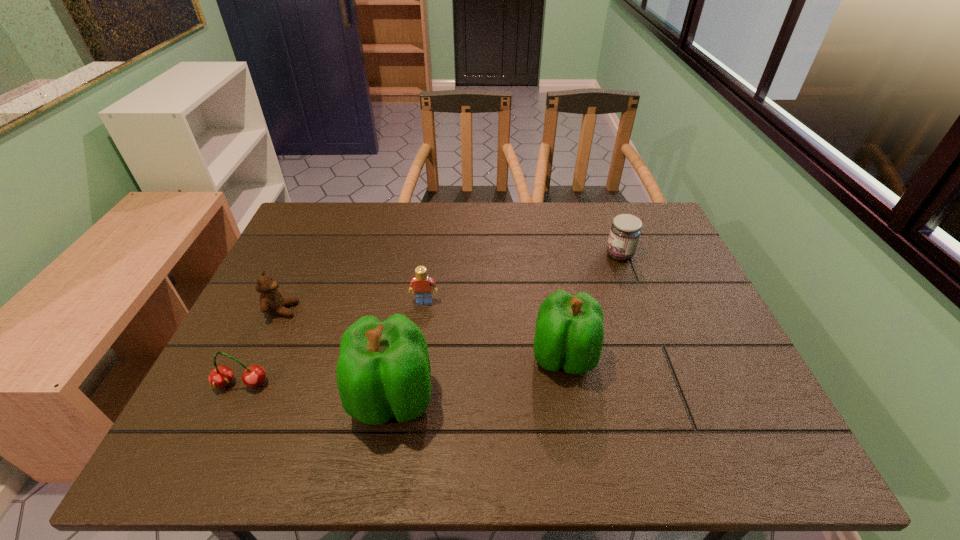
I want to click on the taller bell pepper, so click(383, 371).

This screenshot has width=960, height=540. What are the coordinates of `the tallest object` in the screenshot? It's located at (383, 371).

I want to click on the fifth object from left to right, so click(x=569, y=333).

The width and height of the screenshot is (960, 540). Identify the location of the right bell pepper. (569, 333).

Where is `the rightmost object`? This screenshot has width=960, height=540. the rightmost object is located at coordinates (625, 231).

The image size is (960, 540). I want to click on jam, so click(x=625, y=231).

You are a GUI agent. You are given a task and a screenshot of the screen. Output one action in this format:
    pyautogui.click(x=<x>, y=<y>)
    Task: Click on the teddy bear
    
    Given the screenshot: What is the action you would take?
    pyautogui.click(x=272, y=301)

This screenshot has height=540, width=960. Find the location of `Lego`. Lego is located at coordinates (421, 284).

The image size is (960, 540). In order to click on cherry in this screenshot , I will do pyautogui.click(x=220, y=377).

The width and height of the screenshot is (960, 540). Find the location of `blank space located 0.070m on the right of the left bell pepper`. blank space located 0.070m on the right of the left bell pepper is located at coordinates (467, 400).